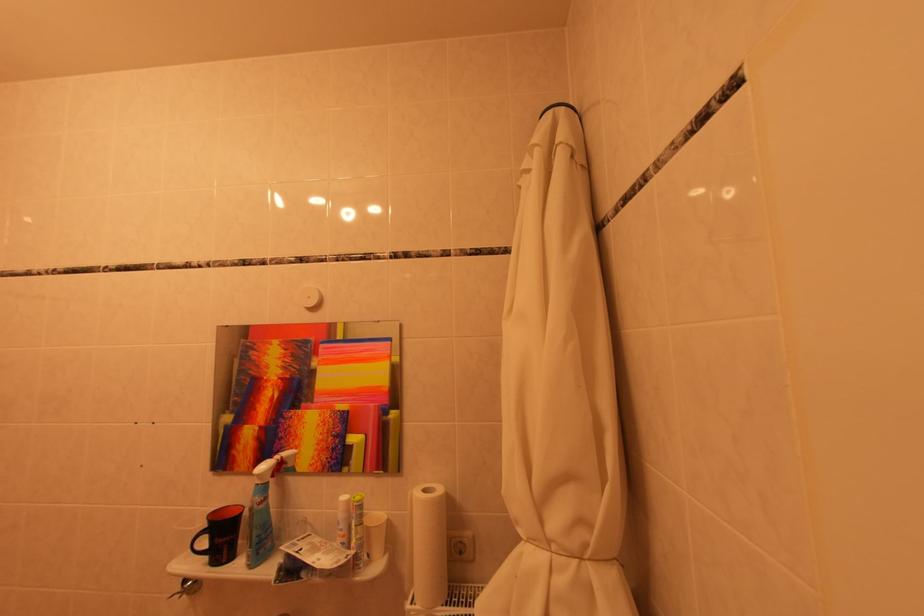
The location [460,546] corresponds to which object?

It refers to a white electrical socket.